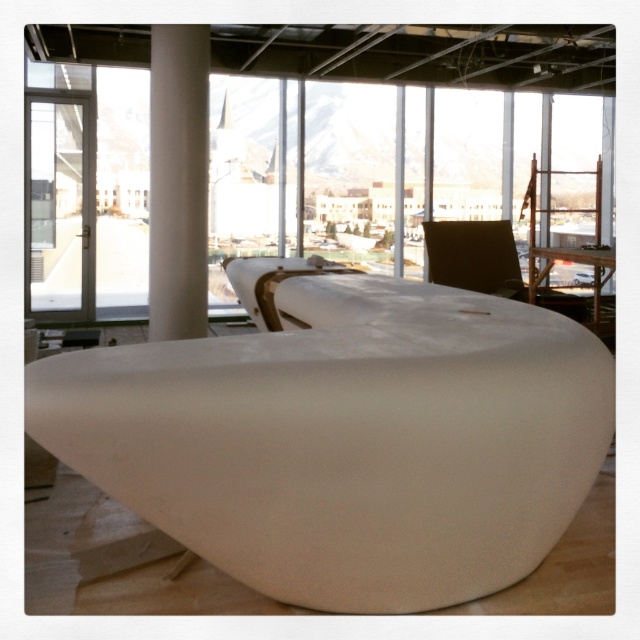
In the scene shown: You are sitting in the brown leather chair at upper right and want to reach the white smooth column at center. Which direction should you move to get closer to it?

The white smooth column at center is to the left of the brown leather chair at upper right, so you should move to your left to get closer to it.